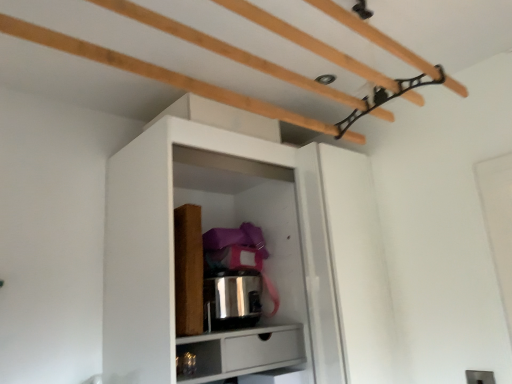
Question: Should I look upward or downward to see white matte drawer at lower center?

Choices:
 (A) down
 (B) up

Answer: (A)